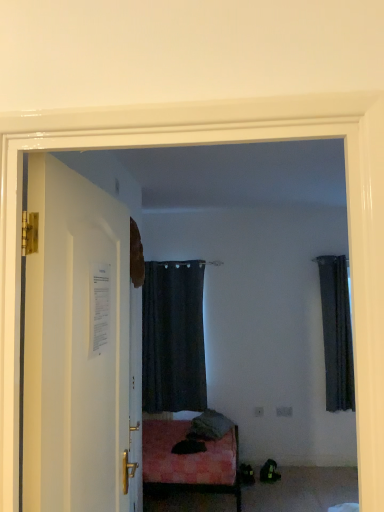
Question: Is black fabric curtain at center, acting as the first curtain starting from the left, bigger or smaller than dark fabric curtain at right, marked as the first curtain in a right-to-left arrangement?

Choices:
 (A) small
 (B) big

Answer: (B)

Question: Considering the positions of black fabric curtain at center, acting as the first curtain starting from the left, and dark fabric curtain at right, marked as the first curtain in a right-to-left arrangement, in the image, is black fabric curtain at center, acting as the first curtain starting from the left, taller or shorter than dark fabric curtain at right, marked as the first curtain in a right-to-left arrangement,?

Choices:
 (A) tall
 (B) short

Answer: (A)

Question: Which is farther from the black fabric curtain at center, which is the 2th curtain in right-to-left order?

Choices:
 (A) dark fabric curtain at right, the 2th curtain in the left-to-right sequence
 (B) white glossy door at left

Answer: (B)

Question: Based on their relative distances, which object is nearer to the white glossy door at left?

Choices:
 (A) dark fabric curtain at right, marked as the first curtain in a right-to-left arrangement
 (B) black fabric curtain at center, acting as the first curtain starting from the left

Answer: (B)